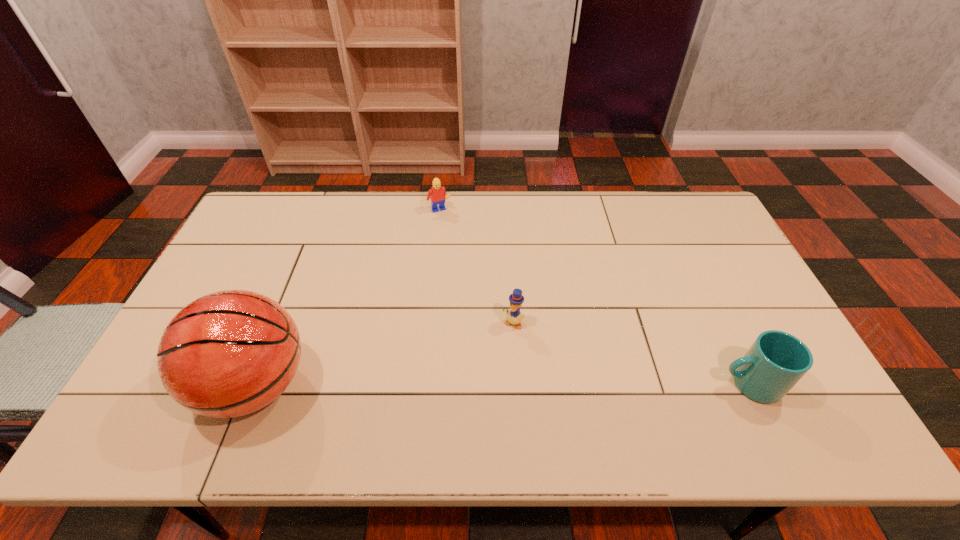
Where is `vacant region located on the handle side of the rightmost object`? vacant region located on the handle side of the rightmost object is located at coordinates (657, 384).

Identify the location of free spot located on the front-facing side of the Lego. click(x=454, y=236).

Identify the location of free region located on the front-facing side of the Lego. Image resolution: width=960 pixels, height=540 pixels. (459, 245).

Image resolution: width=960 pixels, height=540 pixels. Find the location of `vacant area located 0.190m on the front-facing side of the Lego`. vacant area located 0.190m on the front-facing side of the Lego is located at coordinates (462, 249).

You are a GUI agent. You are given a task and a screenshot of the screen. Output one action in this format:
    pyautogui.click(x=<x>, y=<y>)
    Task: Click on the free space located 0.100m on the face of the duckling, where the monocle is placed
    
    Given the screenshot: What is the action you would take?
    pyautogui.click(x=493, y=357)

Find the location of a particular element. vacant area situated 0.080m on the face of the duckling, where the monocle is placed is located at coordinates coord(497,352).

Where is `object at the far edge`? This screenshot has height=540, width=960. object at the far edge is located at coordinates 437,194.

At what (x,y) coordinates should I click in order to perform the action: click on basketball positioned at the near edge. Please return your answer as a coordinate pair (x, y). Looking at the image, I should click on (230, 353).

Where is `cup that is at the near edge`? The width and height of the screenshot is (960, 540). cup that is at the near edge is located at coordinates (776, 361).

What are the coordinates of `object present at the left edge` in the screenshot? It's located at (230, 353).